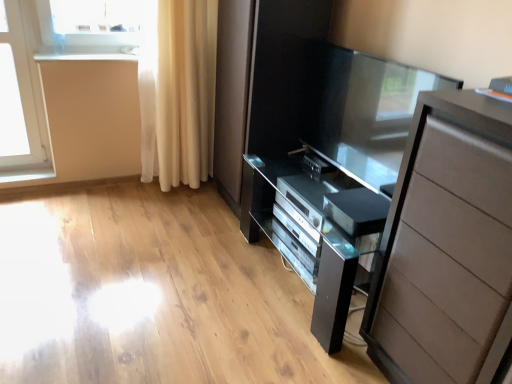
Question: From the image's perspective, relative to light beige sheer curtain at left, is white glossy window sill at upper left above or below?

Choices:
 (A) below
 (B) above

Answer: (B)

Question: Is point (84, 51) positioned closer to the camera than point (187, 26)?

Choices:
 (A) closer
 (B) farther

Answer: (B)

Question: Which is farther from the white glossy window sill at upper left?

Choices:
 (A) transparent glass screen door at center
 (B) satin silver dvd player at lower center, the 1th appliance from the front
 (C) white glass window at upper left
 (D) satin black tv at center, the 1th appliance viewed from the back
 (E) black glass tv stand at center

Answer: (B)

Question: Which object is positioned closest to the black glass tv stand at center?

Choices:
 (A) light beige sheer curtain at left
 (B) white glossy window sill at upper left
 (C) satin silver dvd player at lower center, the 2th appliance in the back-to-front sequence
 (D) white glass window at upper left
 (E) matte brown chest of drawers at right

Answer: (C)